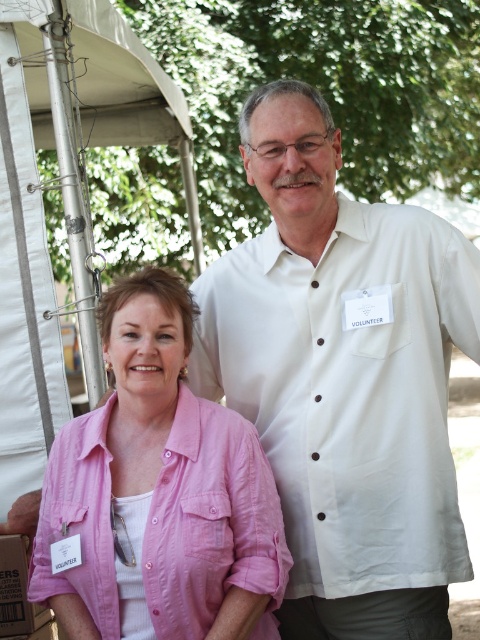
In the scene shown: Please provide the 2D coordinates of the white cotton shirt at upper right in the image. The coordinates should be in the format of a point with two decimal places, such as 0.5,0.5.

The 2D coordinates of the white cotton shirt at upper right are at point [349,388].

You are organizing a charity event and need to place a white cotton shirt at upper right and a cardboard box at lower left. According to the image, which object is located above the other?

The white cotton shirt at upper right is positioned over the cardboard box at lower left, meaning it is above the box.

You are a photographer standing 1 meter away from the pink cotton shirt at center and the cardboard box at lower left. You want to take a photo of both objects in the same frame. Given that your camera has a 50mm lens, which has a field of view of 46 degrees, can you capture both objects in the frame without moving closer? Explain your reasoning.

The pink cotton shirt at center and cardboard box at lower left are 61.05 centimeters apart. Since the photographer is 1 meter away, the distance between the objects is within the camera lens field of view of 46 degrees. Therefore, both objects can be captured in the same frame without moving closer.